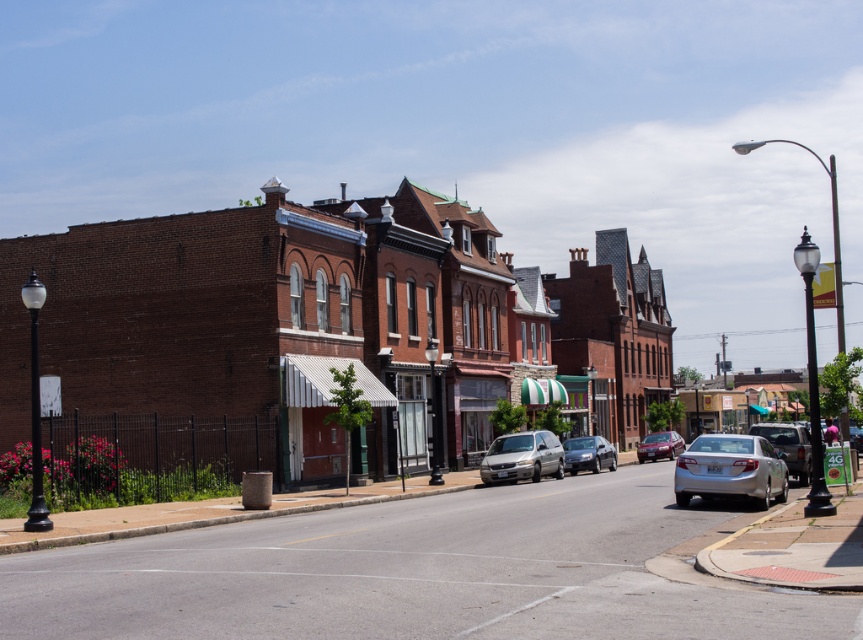
Between silver metallic minivan at center and silver metallic sedan at right, which one has more height?

silver metallic sedan at right

Does silver metallic minivan at center have a smaller size compared to silver metallic sedan at right?

Yes.

The width and height of the screenshot is (863, 640). Describe the element at coordinates (521, 458) in the screenshot. I see `silver metallic minivan at center` at that location.

At what (x,y) coordinates should I click in order to perform the action: click on silver metallic minivan at center. Please return your answer as a coordinate pair (x, y). The height and width of the screenshot is (640, 863). Looking at the image, I should click on (521, 458).

Is silver metallic sedan at right in front of shiny red sedan at center?

Yes, it is in front of shiny red sedan at center.

Between point (801, 472) and point (654, 435), which one is positioned behind?

Point (654, 435)

The width and height of the screenshot is (863, 640). What do you see at coordinates (789, 445) in the screenshot?
I see `silver metallic sedan at right` at bounding box center [789, 445].

Find the location of a particular element. Image resolution: width=863 pixels, height=640 pixels. silver metallic sedan at right is located at coordinates (789, 445).

Who is more distant from viewer, (x=8, y=307) or (x=589, y=442)?

The point (x=589, y=442) is behind.

Where is `brown brick building at center`? Image resolution: width=863 pixels, height=640 pixels. brown brick building at center is located at coordinates (269, 323).